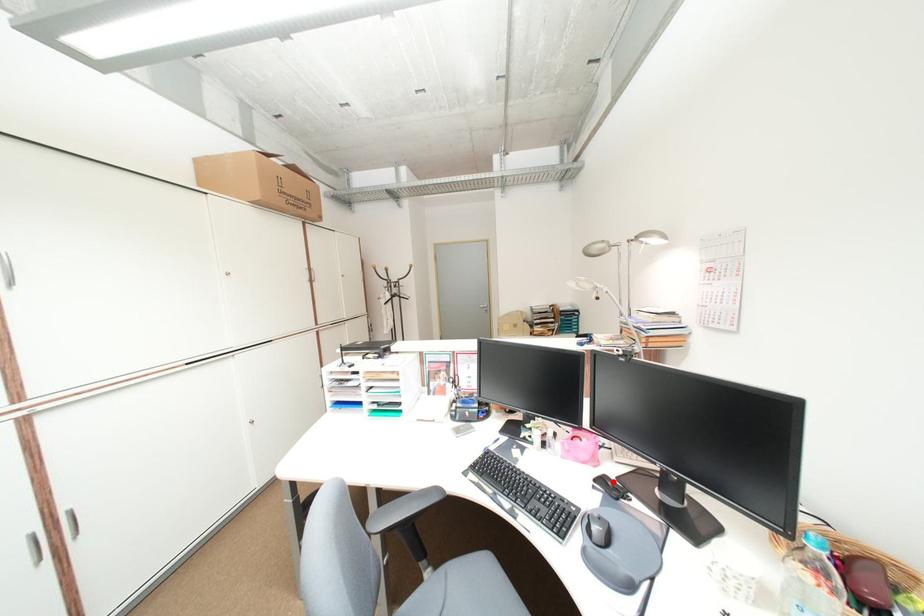
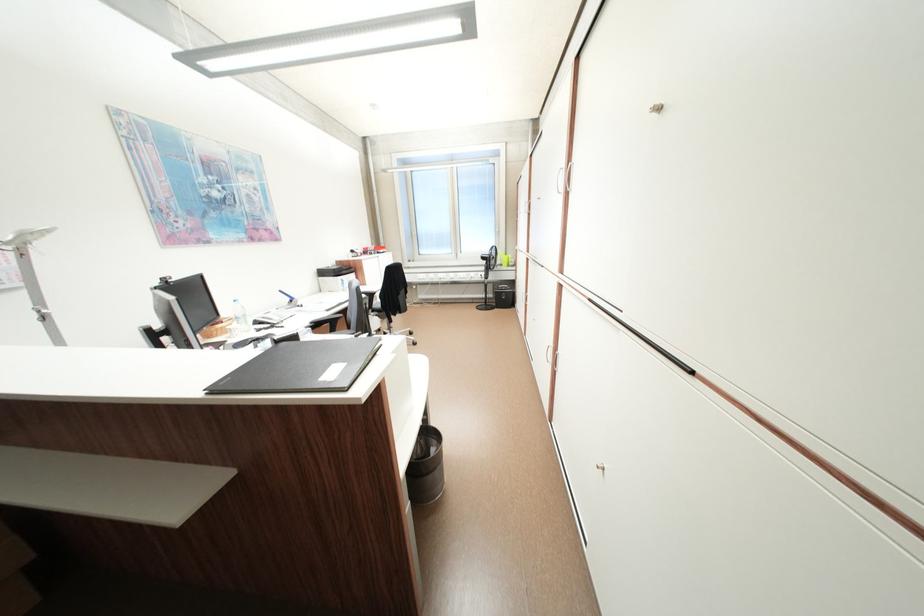
Question: I am providing you with two images of the same scene from different viewpoints. A red point is marked on the first image. At the location where the point appears in image 1, is it still visible in image 2?

Choices:
 (A) Yes
 (B) No

Answer: (B)